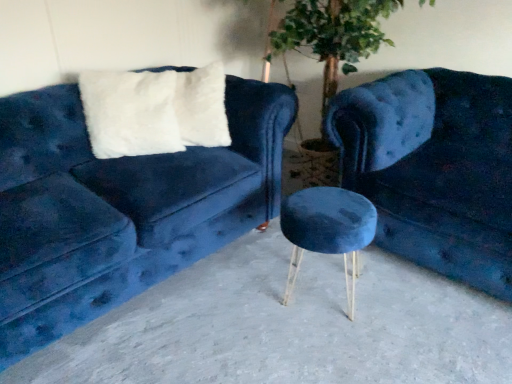
Where is `free region under velvet blue stool at center (from a real-world perspective)`? This screenshot has height=384, width=512. free region under velvet blue stool at center (from a real-world perspective) is located at coordinates [x=325, y=291].